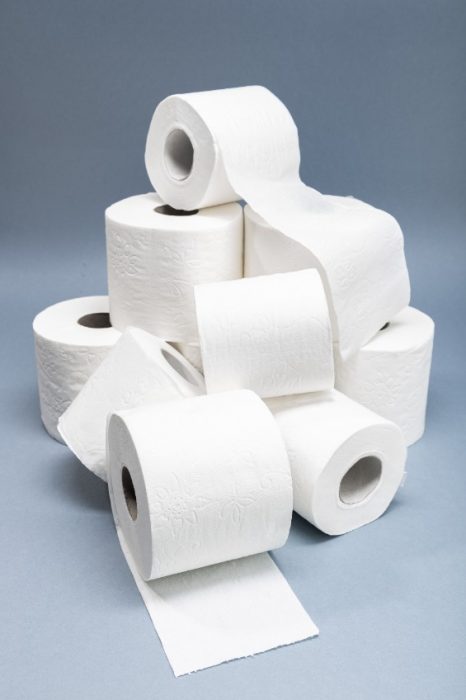
Where is `toilet tissue rolls`? The image size is (466, 700). toilet tissue rolls is located at coordinates (196, 157), (179, 234), (270, 239), (267, 355), (77, 367), (127, 388), (194, 465), (347, 428), (398, 388).